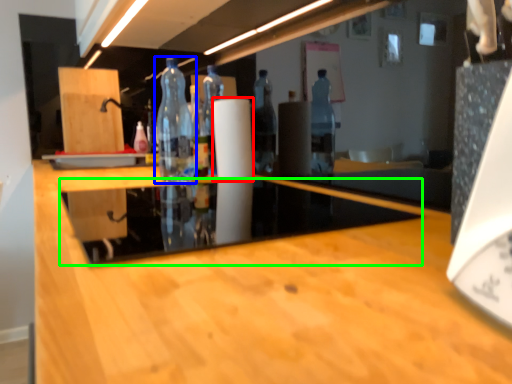
Question: Based on their relative distances, which object is nearer to paper towel (highlighted by a red box)? Choose from bottle (highlighted by a blue box) and glass table (highlighted by a green box).

Choices:
 (A) bottle
 (B) glass table

Answer: (A)